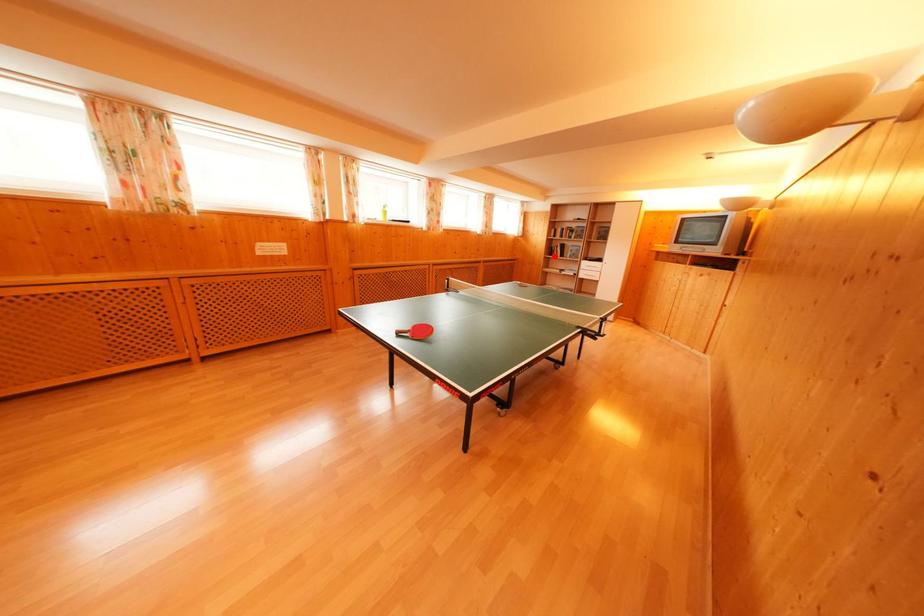
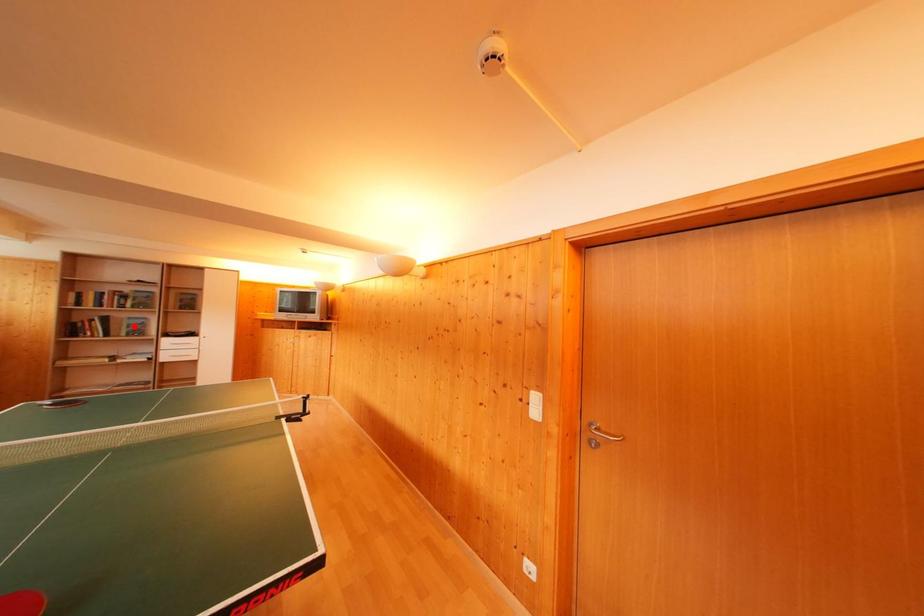
I am providing you with two images of the same scene from different viewpoints. A red point is marked on the first image and another point is marked on the second image. Are the points marked in image1 and image2 representing the same 3D position?

No